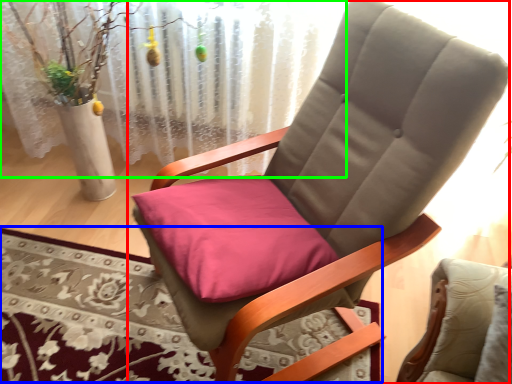
Question: Based on their relative distances, which object is nearer to chair (highlighted by a red box)? Choose from mat (highlighted by a blue box) and curtain (highlighted by a green box).

Choices:
 (A) mat
 (B) curtain

Answer: (A)